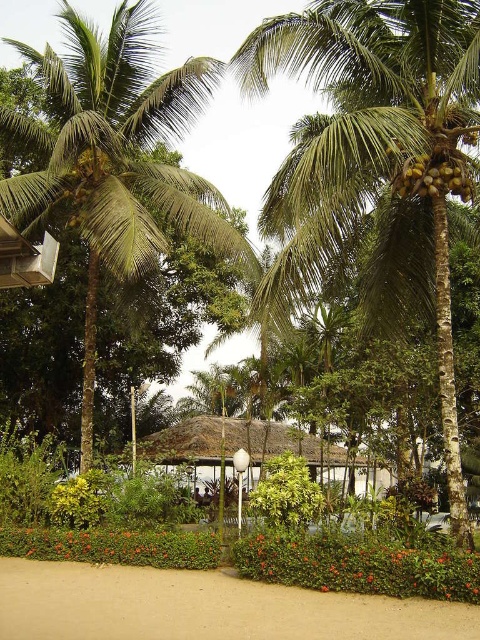
Question: Which of these objects is positioned closest to the sandy beach at lower center?

Choices:
 (A) thatched roof hut at center
 (B) green leafy palm tree at center

Answer: (B)

Question: Which point is farther to the camera?

Choices:
 (A) (442, 349)
 (B) (223, 596)

Answer: (A)

Question: Is sandy beach at lower center smaller than thatched roof hut at center?

Choices:
 (A) yes
 (B) no

Answer: (A)

Question: Which of the following is the farthest from the observer?

Choices:
 (A) sandy beach at lower center
 (B) green leafy palm tree at center
 (C) thatched roof hut at center

Answer: (B)

Question: Does green leafy coconut tree at center have a lesser width compared to green leafy palm tree at center?

Choices:
 (A) yes
 (B) no

Answer: (A)

Question: Is green leafy palm tree at center below sandy beach at lower center?

Choices:
 (A) yes
 (B) no

Answer: (B)